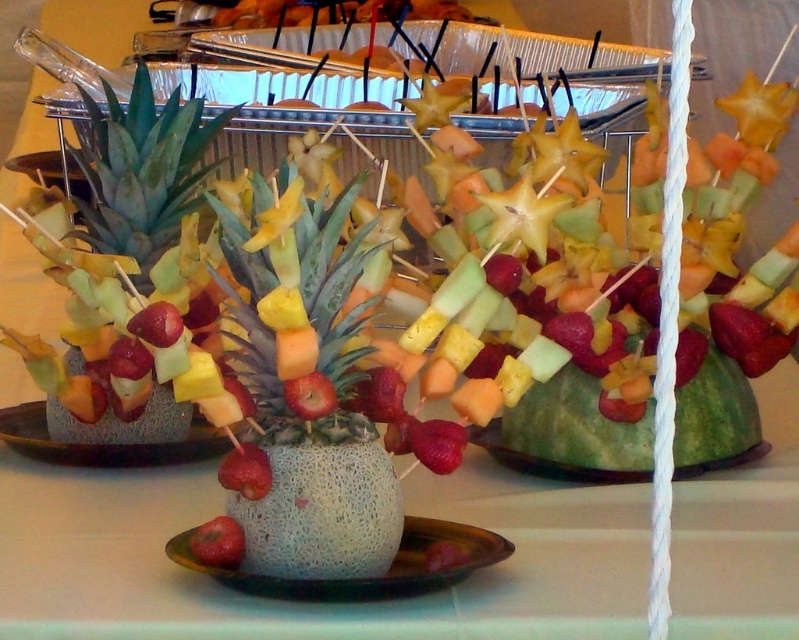
Question: Which point appears farthest from the camera in this image?

Choices:
 (A) (245, 492)
 (B) (237, 554)
 (C) (18, 419)

Answer: (C)

Question: Does green leafy pineapple at center appear over green melon at center?

Choices:
 (A) no
 (B) yes

Answer: (B)

Question: Does green leafy pineapple at center have a smaller size compared to speckled melon plate at center?

Choices:
 (A) yes
 (B) no

Answer: (B)

Question: Which object appears closest to the camera in this image?

Choices:
 (A) green textured pineapple at center
 (B) speckled melon plate at center

Answer: (A)

Question: Is green textured pineapple at center to the right of green leafy pineapple at center from the viewer's perspective?

Choices:
 (A) no
 (B) yes

Answer: (B)

Question: Which of these objects is positioned farthest from the green melon at center?

Choices:
 (A) smooth melon at center
 (B) speckled melon plate at center
 (C) green textured pineapple at center
 (D) metallic silver tray at upper center

Answer: (D)